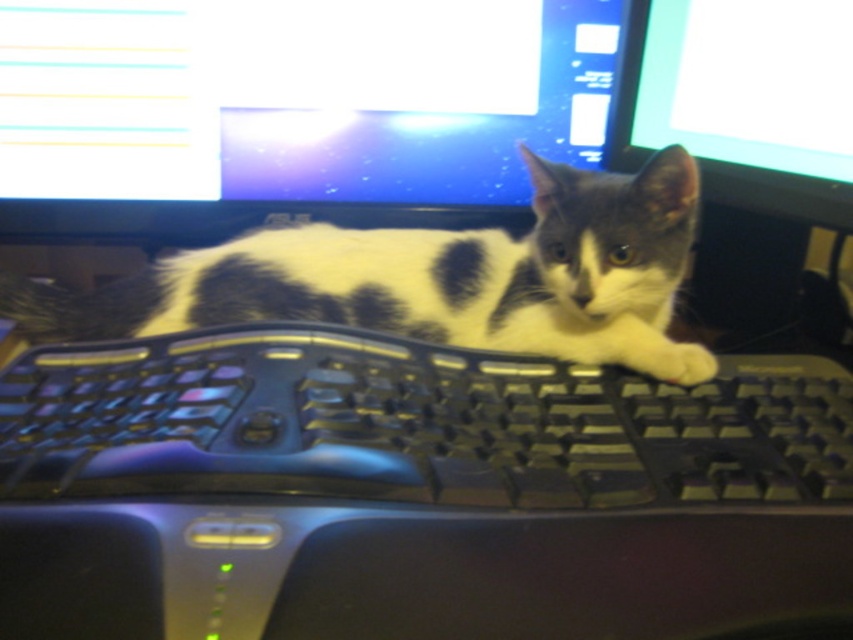
Can you confirm if black plastic keyboard at center is positioned above matte black monitor at upper center?

No, black plastic keyboard at center is not above matte black monitor at upper center.

Between black plastic keyboard at center and matte black monitor at upper center, which one appears on the right side from the viewer's perspective?

From the viewer's perspective, black plastic keyboard at center appears more on the right side.

Does point (534, 384) come closer to viewer compared to point (334, 214)?

Yes, point (534, 384) is closer to viewer.

This screenshot has width=853, height=640. Find the location of `black plastic keyboard at center`. black plastic keyboard at center is located at coordinates (428, 486).

Does black plastic keyboard at center come behind white-furred cat at center?

No, black plastic keyboard at center is closer to the viewer.

Identify the location of black plastic keyboard at center. This screenshot has width=853, height=640. (428, 486).

Is point (781, 401) farther from camera compared to point (688, 157)?

No, (781, 401) is closer to viewer.

Image resolution: width=853 pixels, height=640 pixels. What are the coordinates of `black plastic keyboard at center` in the screenshot? It's located at click(x=428, y=486).

Who is lower down, white-furred cat at center or matte black monitor at upper right?

white-furred cat at center is below.

Does white-furred cat at center have a lesser height compared to matte black monitor at upper right?

Correct, white-furred cat at center is not as tall as matte black monitor at upper right.

This screenshot has width=853, height=640. In order to click on white-furred cat at center in this screenshot , I will do `click(434, 276)`.